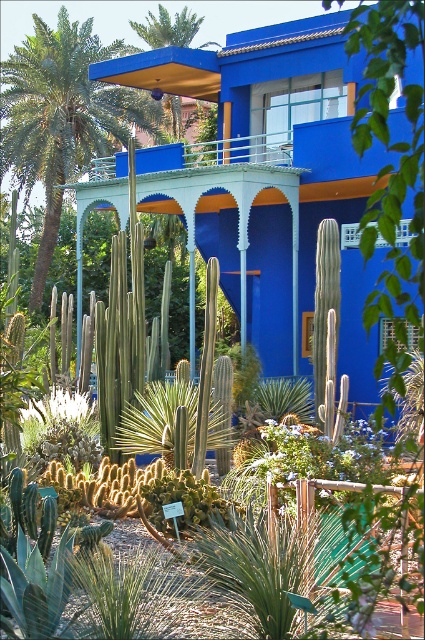
You are an architect designing a new garden layout and need to know the spatial arrangement of the green leafy palm tree at upper left and the green leafy palm tree at upper center. Which of these two palm trees is wider?

The green leafy palm tree at upper left is wider than the green leafy palm tree at upper center according to the description provided.